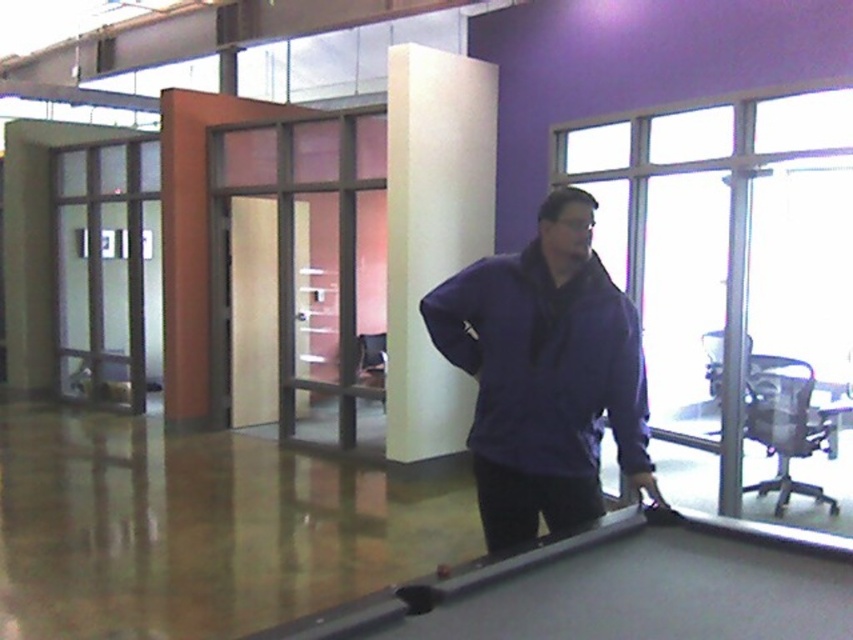
You are an office worker who needs to place a new plant pot between the purple matte jacket at center and the white matte pillar at center. According to the scene description, where should you position the plant pot relative to these two objects?

The purple matte jacket at center is located below the white matte pillar at center. Therefore, to place the plant pot between them, you should position it between the purple matte jacket at center and the white matte pillar at center, ensuring it is above the jacket and below the pillar.

You are an office worker who needs to determine if the purple matte jacket at center can be placed on the white matte pillar at center without exceeding its height. Can it fit?

The purple matte jacket at center is not as tall as the white matte pillar at center, so it can be placed on it without exceeding its height.

You are an office worker who wants to move from the white matte pillar at center to the smooth black pool table at center. Which direction should you move in?

The smooth black pool table at center is to the right of the white matte pillar at center, so you should move to the right to reach it.